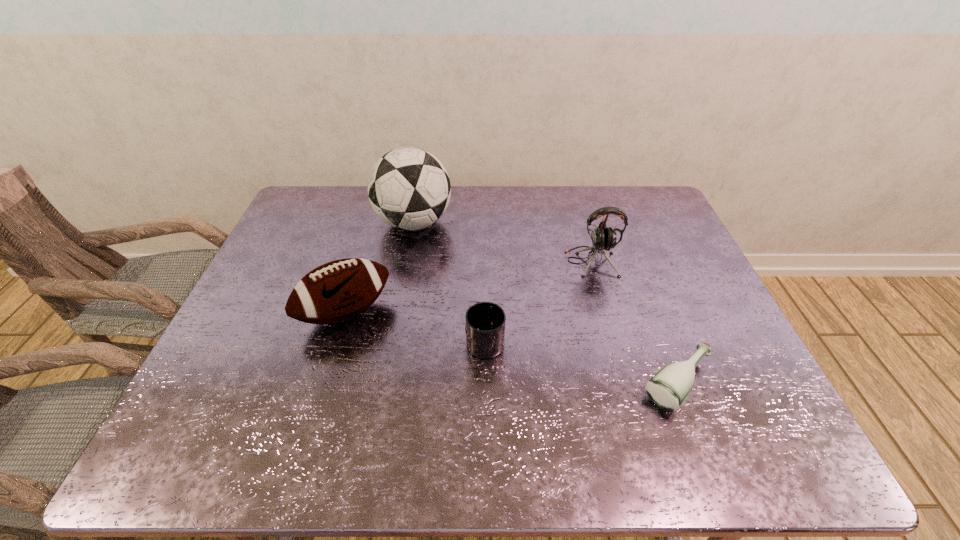
The image size is (960, 540). What are the coordinates of `vacant space located with the handle on the side of the third object from left to right` in the screenshot? It's located at point(484,240).

This screenshot has height=540, width=960. In order to click on vacant space located with the handle on the side of the third object from left to right in this screenshot , I will do `click(484, 279)`.

Identify the location of vacant area situated on the left of the bottle. The width and height of the screenshot is (960, 540). (520, 384).

I want to click on object that is at the far edge, so click(409, 188).

Identify the location of object present at the right edge. This screenshot has height=540, width=960. (668, 389).

What are the coordinates of `vacant space at the far edge of the desktop` in the screenshot? It's located at (538, 197).

In order to click on free region at the near edge in this screenshot , I will do `click(573, 457)`.

Locate an element on the screen. The image size is (960, 540). vacant space at the left edge of the desktop is located at coordinates (224, 338).

In the image, there is a desktop. In order to click on vacant area at the right edge in this screenshot , I will do `click(686, 306)`.

Find the location of a particular element. This screenshot has height=540, width=960. free area in between the third object from left to right and the third shortest object is located at coordinates (416, 326).